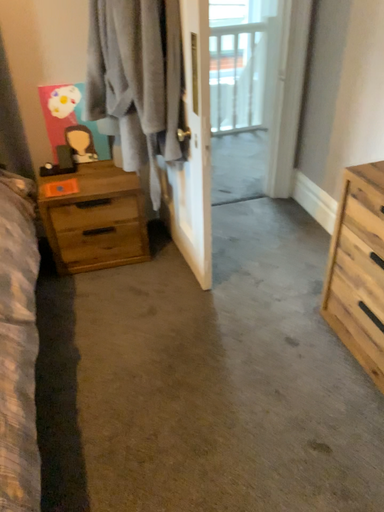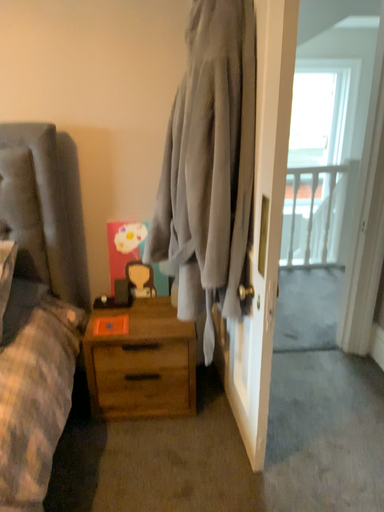
Question: How did the camera likely rotate when shooting the video?

Choices:
 (A) rotated right
 (B) rotated left

Answer: (B)